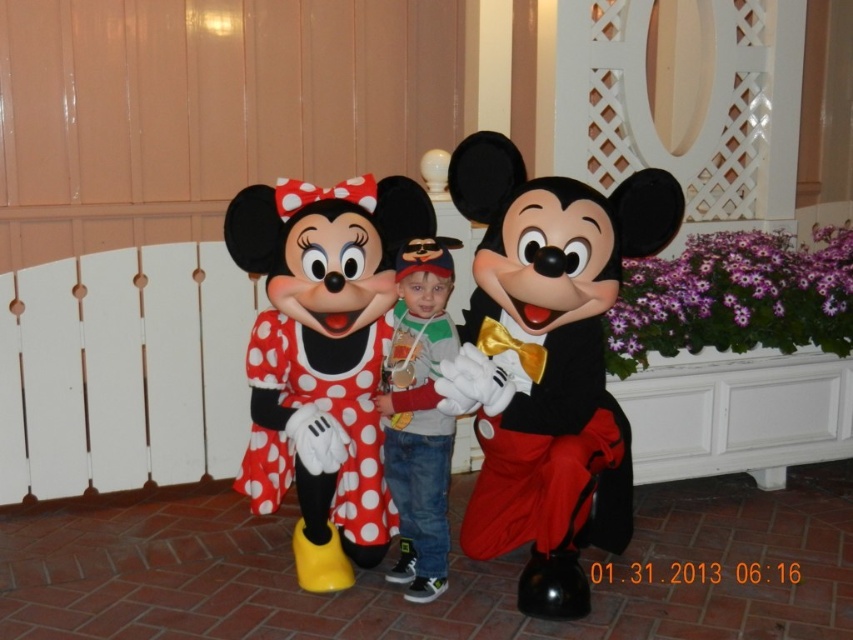
Who is more distant from viewer, [485,554] or [422,332]?

The point [485,554] is behind.

Between matte black bow tie at center and jeans at center, which one has more height?

matte black bow tie at center

At what (x,y) coordinates should I click in order to perform the action: click on matte black bow tie at center. Please return your answer as a coordinate pair (x, y). The image size is (853, 640). Looking at the image, I should click on (548, 362).

Is jeans at center wider than red polka dot dress at center?

Incorrect, jeans at center's width does not surpass red polka dot dress at center's.

Between jeans at center and red polka dot dress at center, which one has less height?

red polka dot dress at center is shorter.

Is point (403, 388) closer to camera compared to point (332, 500)?

Yes, it is.

Where is `jeans at center`? The height and width of the screenshot is (640, 853). jeans at center is located at coordinates (419, 416).

Can you confirm if matte black bow tie at center is shorter than matte polka dot dress at center?

Incorrect, matte black bow tie at center's height does not fall short of matte polka dot dress at center's.

Does matte black bow tie at center have a greater height compared to matte polka dot dress at center?

Indeed, matte black bow tie at center has a greater height compared to matte polka dot dress at center.

Measure the distance between matte black bow tie at center and camera.

8.17 feet

Locate an element on the screen. The height and width of the screenshot is (640, 853). matte black bow tie at center is located at coordinates (548, 362).